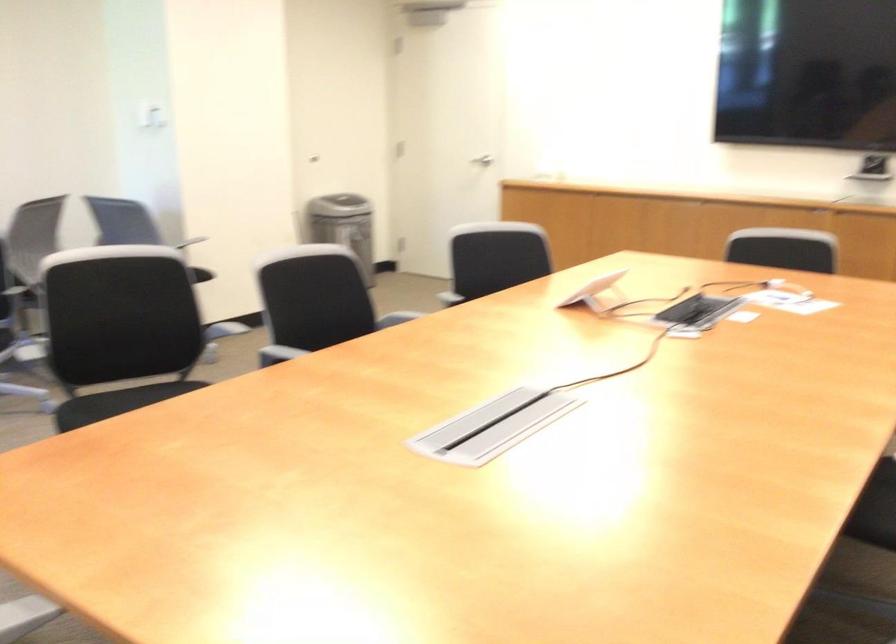
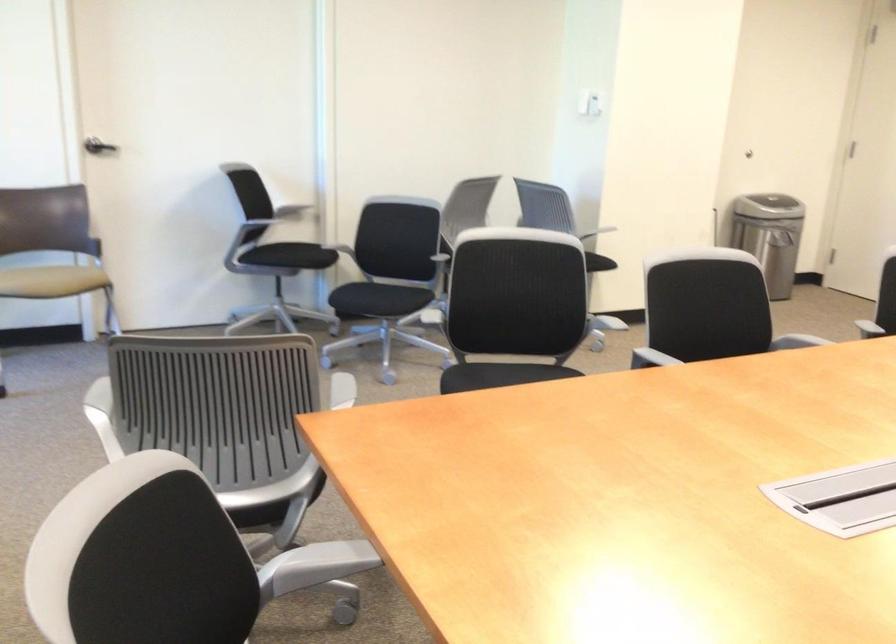
Where in the second image is the point corresponding to point (315, 304) from the first image?

(708, 308)